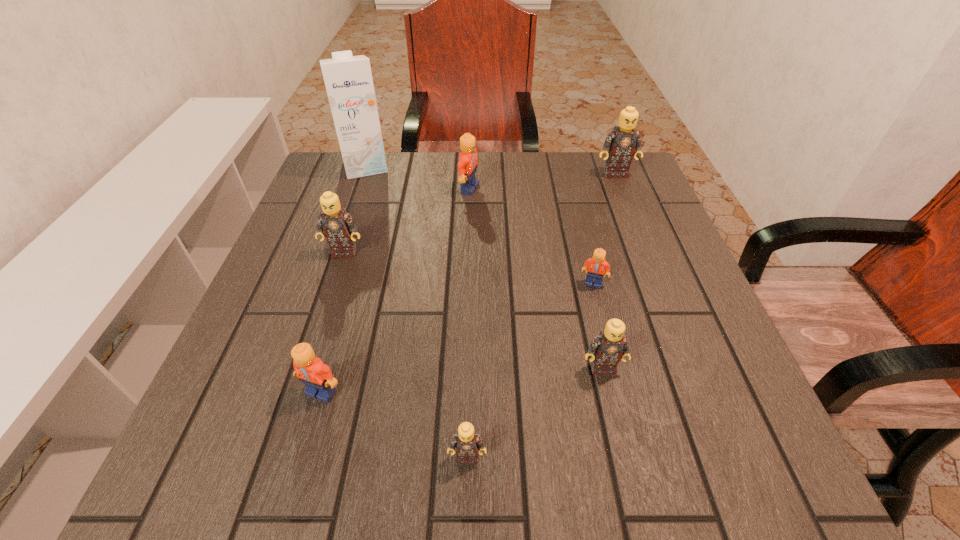
The image size is (960, 540). I want to click on the closest orange Lego relative to the fourth farthest object, so click(x=467, y=166).

Identify which orange Lego is the closest to the second tan Lego from left to right. Please provide its 2D coordinates. Your answer should be formatted as a tuple, i.e. [(x, y)], where the tuple contains the x and y coordinates of a point satisfying the conditions above.

[(317, 377)]